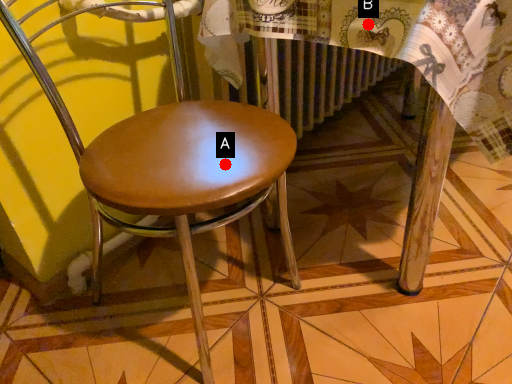
Question: Two points are circled on the image, labeled by A and B beside each circle. Among these points, which one is farthest from the camera?

Choices:
 (A) A is further
 (B) B is further

Answer: (A)